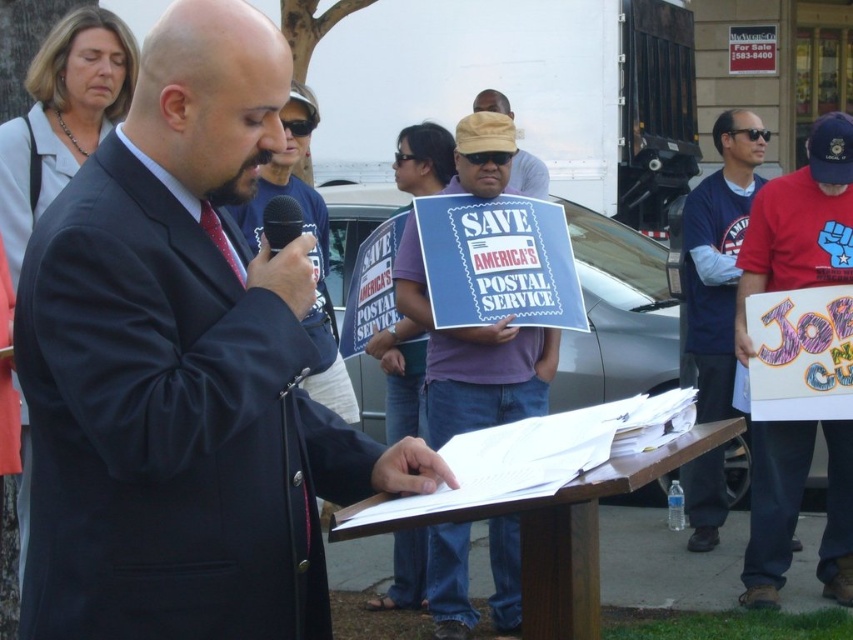
You are a photographer at the event and want to capture a photo where the red cotton shirt at right and the black matte microphone at center are both clearly visible. Based on their positions, will the microphone block the view of the shirt?

The red cotton shirt at right is positioned under the black matte microphone at center, so the microphone will block the view of the shirt in the photo.

You are a photographer at the event and need to capture a clear photo of the dark blue suit at center and the black matte microphone at center. Which object should you focus on first to ensure it appears larger in the photo?

The dark blue suit at center is much taller than the black matte microphone at center, so focusing on the dark blue suit at center first will ensure it appears larger in the photo.

You are a photographer at the event and want to take a photo of the dark blue suit at center and black matte microphone at center. To ensure both are in frame, should you position the microphone to the right of the suit in the photo?

Yes, because the dark blue suit at center is to the left of the black matte microphone at center, so positioning the microphone to the right of the suit in the photo will keep both in frame.